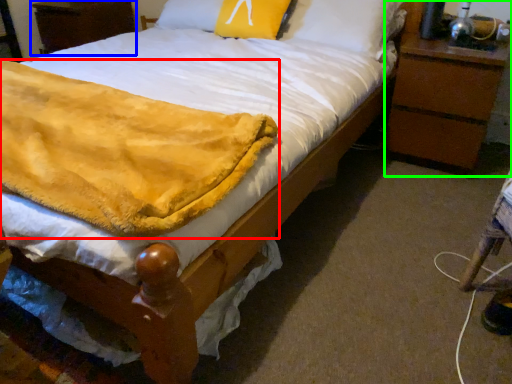
Question: Which object is positioned farthest from blanket (highlighted by a red box)? Select from nightstand (highlighted by a blue box) and nightstand (highlighted by a green box).

Choices:
 (A) nightstand
 (B) nightstand

Answer: (A)